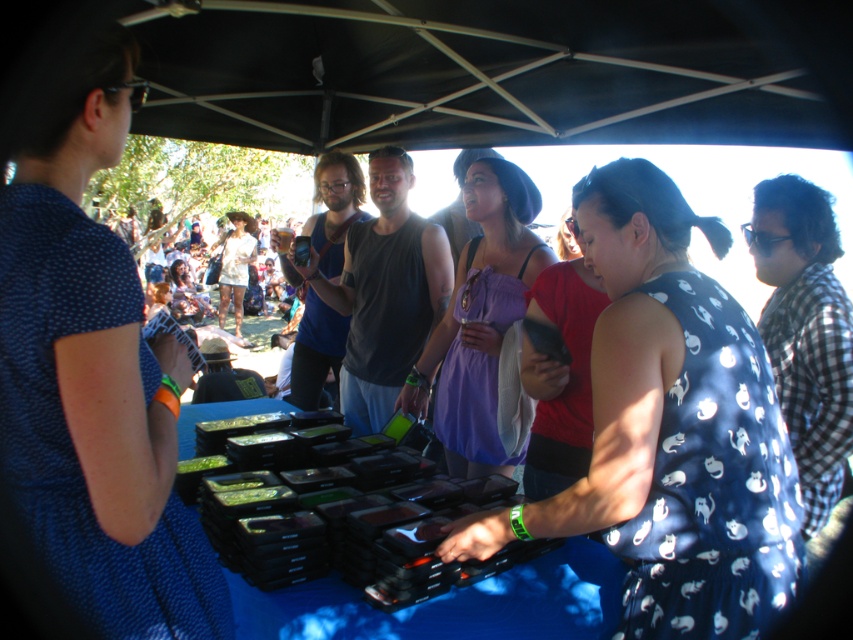
Is blue dotted dress at center wider than purple satin dress at center?

Indeed, blue dotted dress at center has a greater width compared to purple satin dress at center.

Which is in front, point (695, 340) or point (454, 280)?

Positioned in front is point (695, 340).

I want to click on blue dotted dress at center, so click(x=670, y=429).

What do you see at coordinates (670, 429) in the screenshot?
I see `blue dotted dress at center` at bounding box center [670, 429].

The image size is (853, 640). I want to click on blue dotted dress at center, so click(670, 429).

What do you see at coordinates (670, 429) in the screenshot?
I see `blue dotted dress at center` at bounding box center [670, 429].

Where is `blue dotted dress at center`? blue dotted dress at center is located at coordinates (670, 429).

Locate an element on the screen. Image resolution: width=853 pixels, height=640 pixels. blue dotted dress at left is located at coordinates (94, 378).

Does blue dotted dress at left appear on the left side of matte white dress at center?

No, blue dotted dress at left is not to the left of matte white dress at center.

Is point (76, 148) farther from camera compared to point (242, 225)?

No.

Locate an element on the screen. The height and width of the screenshot is (640, 853). blue dotted dress at left is located at coordinates pyautogui.click(x=94, y=378).